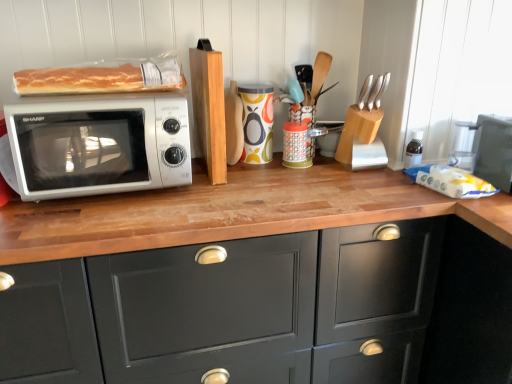
At what (x,y) coordinates should I click in order to perform the action: click on free space above matte black cabinet at center (from a real-world perspective). Please return your answer as a coordinate pair (x, y). This screenshot has height=384, width=512. Looking at the image, I should click on (233, 193).